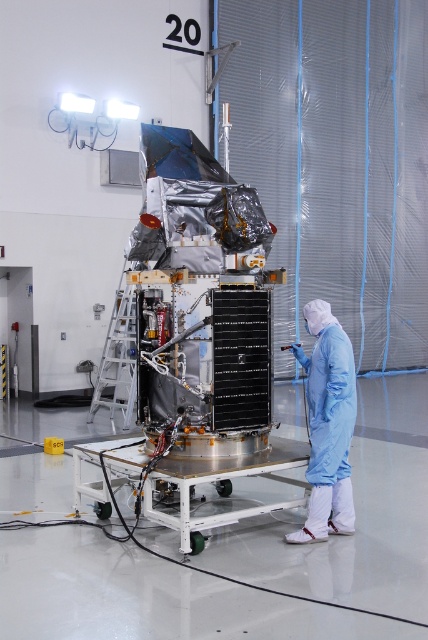
Question: Can you confirm if silver reflective satellite at center is positioned below blue smooth suit at center?

Choices:
 (A) no
 (B) yes

Answer: (A)

Question: Can you confirm if silver reflective satellite at center is wider than blue smooth suit at center?

Choices:
 (A) yes
 (B) no

Answer: (A)

Question: Which point appears farthest from the camera in this image?

Choices:
 (A) (267, 236)
 (B) (344, 508)

Answer: (A)

Question: Does silver reflective satellite at center have a greater width compared to blue smooth suit at center?

Choices:
 (A) yes
 (B) no

Answer: (A)